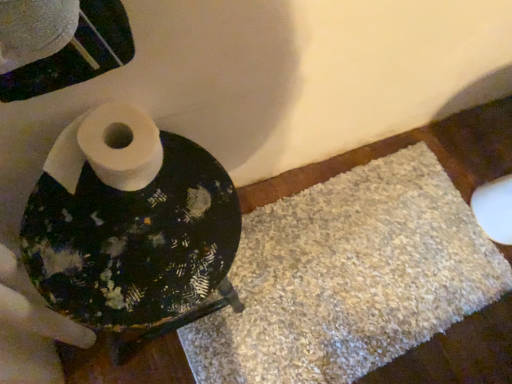
The width and height of the screenshot is (512, 384). I want to click on vacant space to the right of white matte toilet paper at center, so click(x=191, y=210).